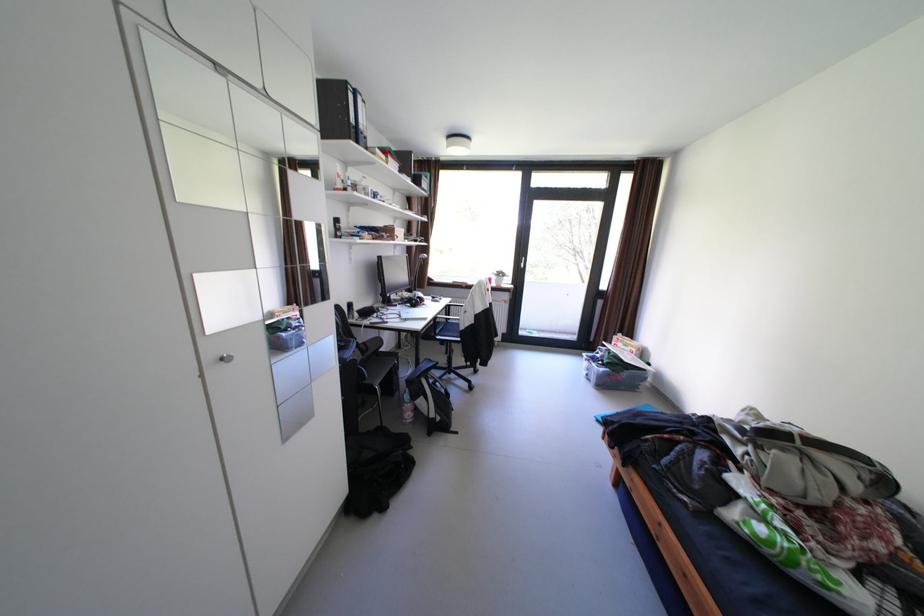
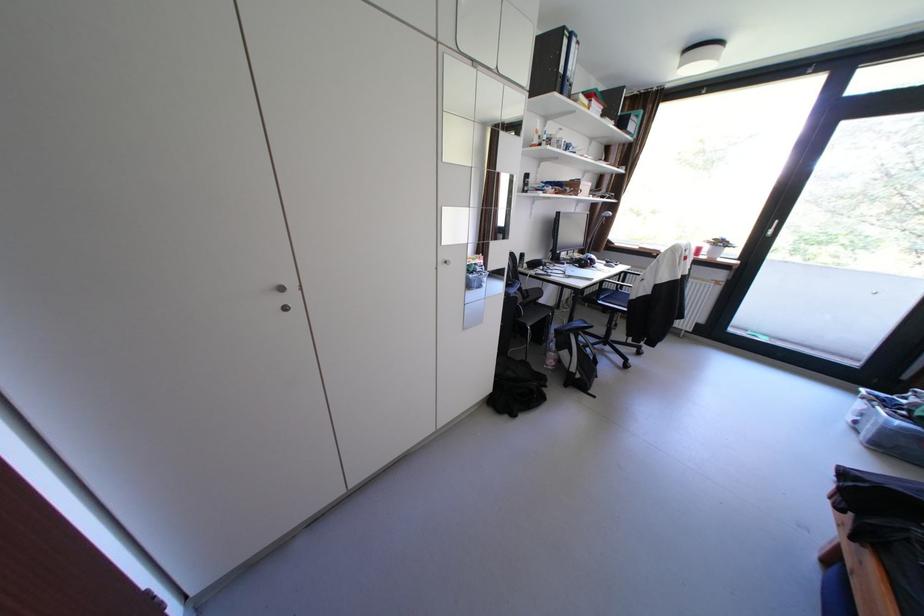
In the second image, find the point that corresponds to [407,306] in the first image.

(574, 264)